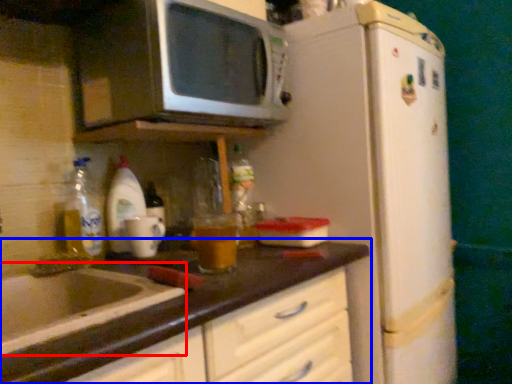
Question: Which point is closer to the camera, sink (highlighted by a red box) or countertop (highlighted by a blue box)?

Choices:
 (A) sink
 (B) countertop

Answer: (B)